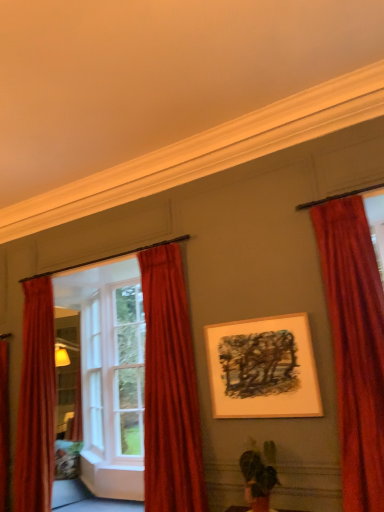
Question: Can you confirm if white wood window frame at left is shorter than green matte plant at lower center?

Choices:
 (A) yes
 (B) no

Answer: (B)

Question: Is white wood window frame at left smaller than green matte plant at lower center?

Choices:
 (A) no
 (B) yes

Answer: (A)

Question: Is white wood window frame at left outside green matte plant at lower center?

Choices:
 (A) no
 (B) yes

Answer: (B)

Question: Can you confirm if white wood window frame at left is positioned to the left of green matte plant at lower center?

Choices:
 (A) no
 (B) yes

Answer: (B)

Question: From the image's perspective, is white wood window frame at left on green matte plant at lower center?

Choices:
 (A) yes
 (B) no

Answer: (A)

Question: Is white wood window frame at left in front of or behind velvet red curtain at left, the first curtain from the left, in the image?

Choices:
 (A) behind
 (B) front

Answer: (B)

Question: From a real-world perspective, is white wood window frame at left positioned above or below velvet red curtain at left, the 3th curtain in the right-to-left sequence?

Choices:
 (A) above
 (B) below

Answer: (A)

Question: From the image's perspective, is white wood window frame at left positioned above or below velvet red curtain at left, the first curtain from the left?

Choices:
 (A) below
 (B) above

Answer: (B)

Question: Is point (36, 316) positioned closer to the camera than point (44, 287)?

Choices:
 (A) closer
 (B) farther

Answer: (A)

Question: From the image's perspective, relative to green matte plant at lower center, is velvet red curtain at center, acting as the 2th curtain starting from the right, above or below?

Choices:
 (A) below
 (B) above

Answer: (B)

Question: Is point (178, 437) positioned closer to the camera than point (269, 465)?

Choices:
 (A) farther
 (B) closer

Answer: (A)

Question: Is velvet red curtain at center, acting as the 2th curtain starting from the right, to the left or to the right of green matte plant at lower center in the image?

Choices:
 (A) right
 (B) left

Answer: (B)

Question: Looking at their shapes, would you say velvet red curtain at center, acting as the 2th curtain starting from the right, is wider or thinner than green matte plant at lower center?

Choices:
 (A) wide
 (B) thin

Answer: (A)

Question: Is point (215, 415) closer or farther from the camera than point (258, 457)?

Choices:
 (A) closer
 (B) farther

Answer: (B)

Question: Based on their positions, is wooden framed artwork at center located to the left or right of green matte plant at lower center?

Choices:
 (A) right
 (B) left

Answer: (A)